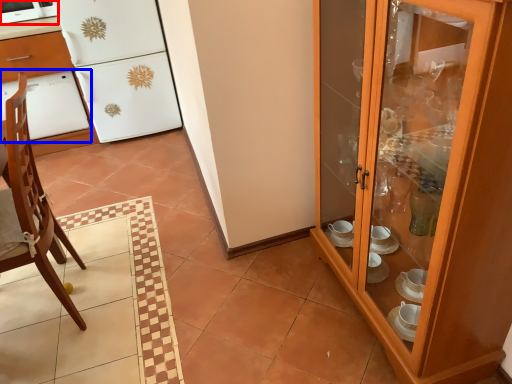
Question: Among these objects, which one is nearest to the camera, home appliance (highlighted by a red box) or oven (highlighted by a blue box)?

Choices:
 (A) home appliance
 (B) oven

Answer: (A)